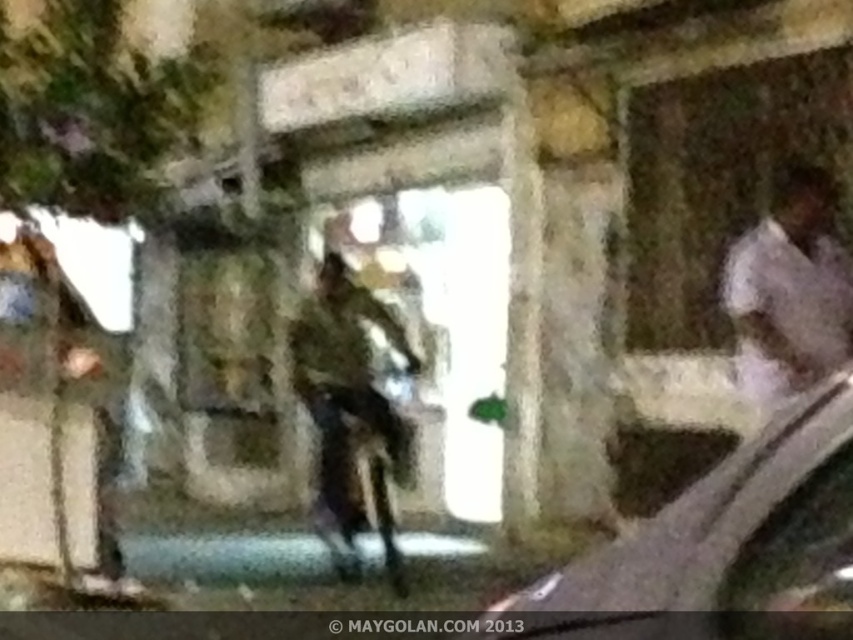
Based on the scene description, where is the camouflage fabric uniform at center located in the image?

The camouflage fabric uniform at center is located at point (352, 413) in the image.

You are a photographer planning to capture a wide shot of the metallic silver car at center and the white fabric shirt at right. Given their sizes, which object should you position closer to the camera to ensure both fit within the frame without cropping?

Since the metallic silver car at center is wider than the white fabric shirt at right, you should position the white fabric shirt at right closer to the camera to maintain their relative sizes within the frame.